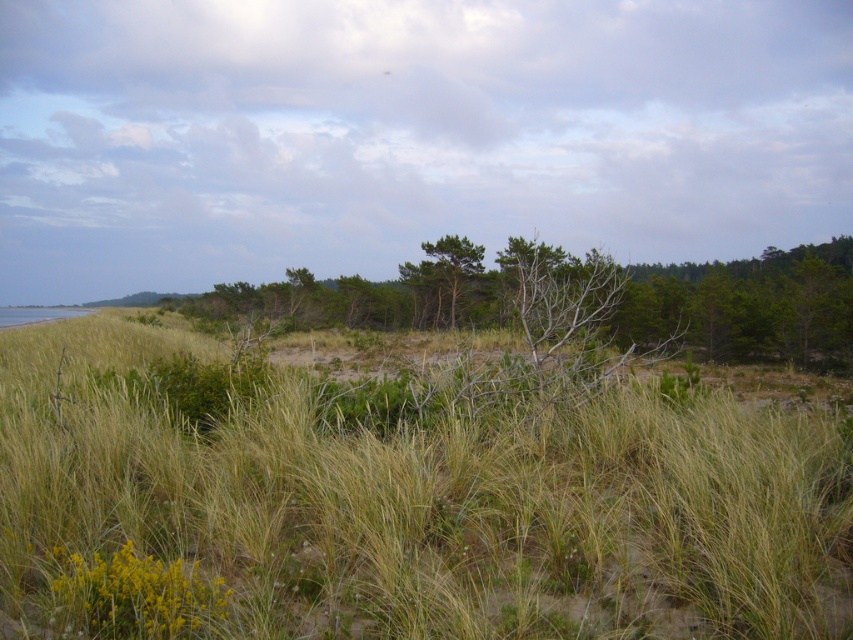
Which of these two, green grassy at center or green matte tree at center, stands taller?

green matte tree at center is taller.

Does point (49, 426) come behind point (706, 339)?

No, (49, 426) is closer to viewer.

Is point (49, 424) more distant than point (772, 260)?

That is False.

Identify the location of green grassy at center. This screenshot has width=853, height=640. (418, 506).